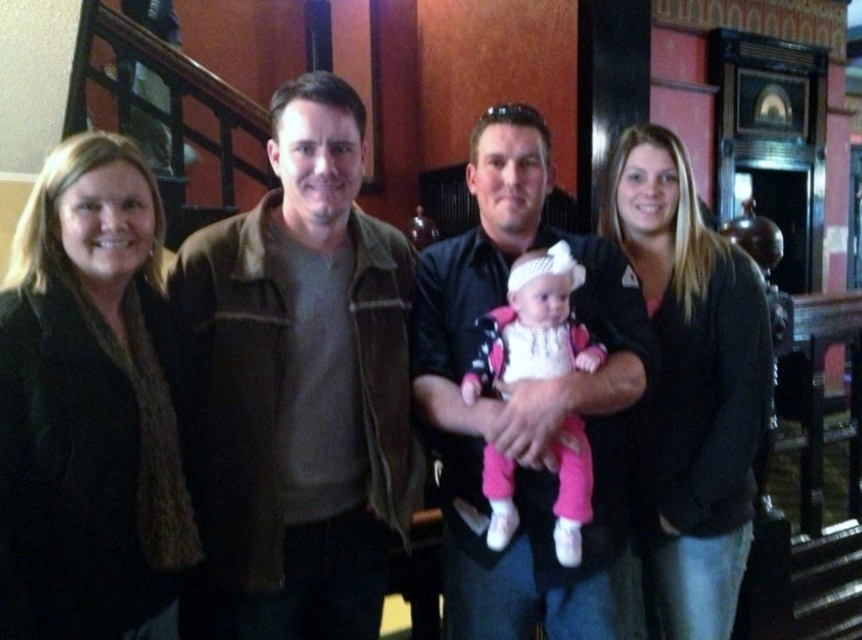
Based on the photo, does brown leather jacket at center have a greater height compared to pink fabric baby at center?

Yes.

Image resolution: width=862 pixels, height=640 pixels. Describe the element at coordinates (300, 388) in the screenshot. I see `brown leather jacket at center` at that location.

Does point (413, 442) lie behind point (539, 328)?

That is True.

Where is `brown leather jacket at center`? The image size is (862, 640). brown leather jacket at center is located at coordinates (300, 388).

Does point (604, 579) lie in front of point (663, 378)?

Yes.

Between point (513, 163) and point (673, 237), which one is positioned behind?

The point (673, 237) is more distant.

I want to click on matte black shirt at center, so click(x=528, y=406).

Who is positioned more to the left, matte black shirt at center or pink fabric baby at center?

From the viewer's perspective, matte black shirt at center appears more on the left side.

The width and height of the screenshot is (862, 640). In order to click on matte black shirt at center in this screenshot , I will do `click(528, 406)`.

This screenshot has height=640, width=862. I want to click on matte black shirt at center, so click(528, 406).